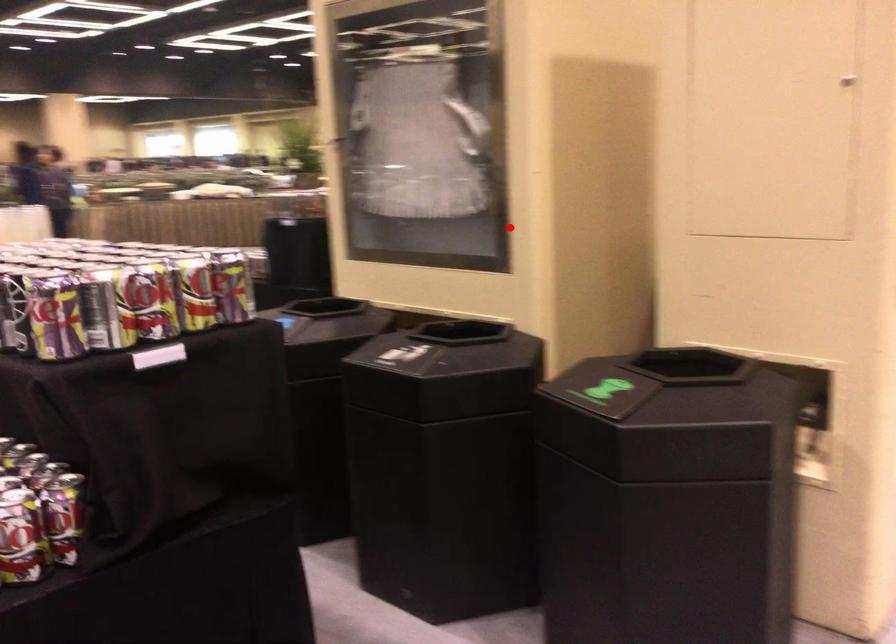
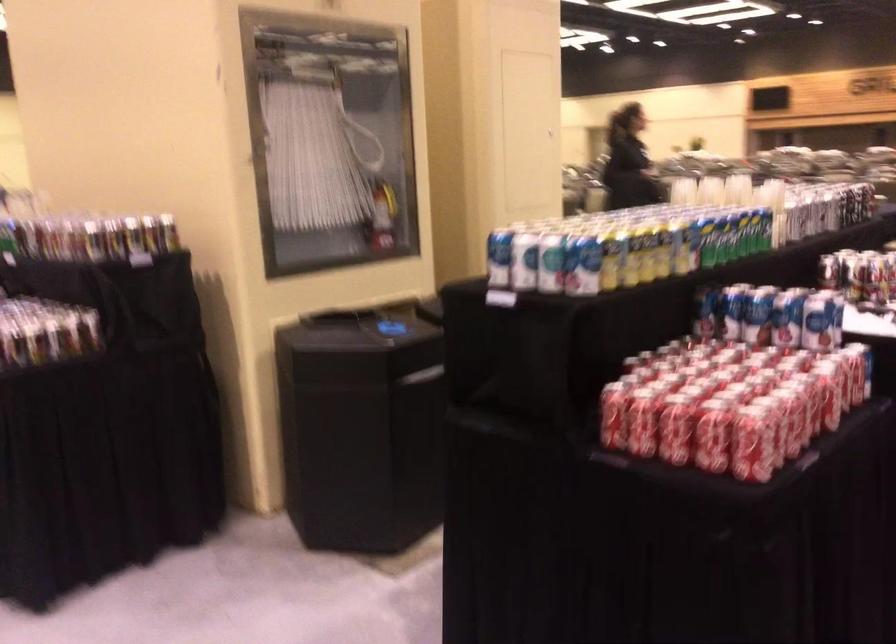
Question: I am providing you with two images of the same scene from different viewpoints. Given a red point in image1, look at the same physical point in image2. Is it:

Choices:
 (A) Closer to the viewpoint
 (B) Farther from the viewpoint

Answer: (B)